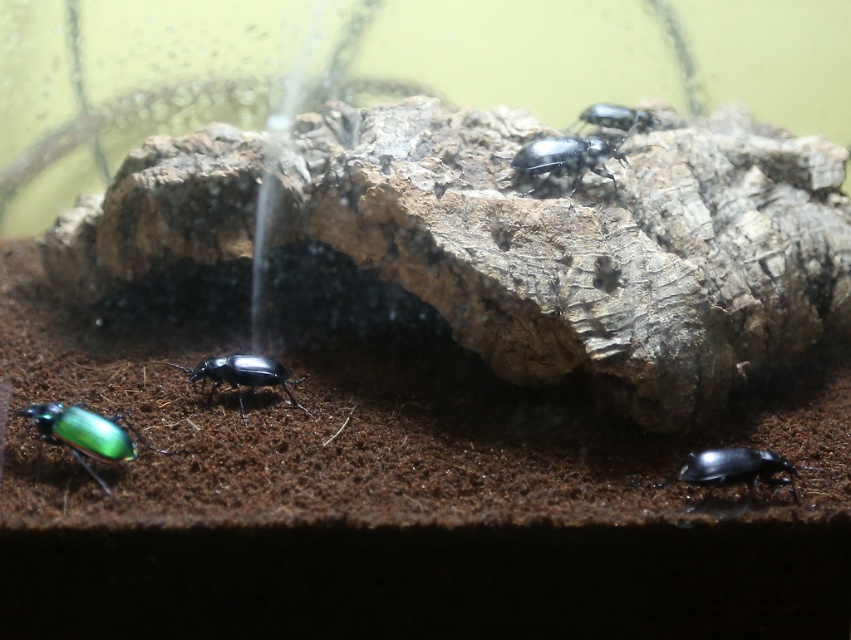
Locate an element on the screen. glossy black beetle at center is located at coordinates (240, 374).

Consider the image. Is glossy black beetle at center smaller than glossy metallic beetle at upper center?

No, glossy black beetle at center is not smaller than glossy metallic beetle at upper center.

Is point (235, 371) behind point (598, 106)?

No, it is not.

I want to click on glossy black beetle at center, so click(240, 374).

Can you confirm if glossy black beetle at lower right is taller than glossy metallic beetle at upper center?

No.

Looking at this image, who is more distant from viewer, [677,474] or [625,125]?

Point [625,125]

Where is `glossy black beetle at lower right`? glossy black beetle at lower right is located at coordinates (735, 468).

Does matte brown rock at center lie behind glossy black beetle at lower right?

Yes, it is behind glossy black beetle at lower right.

Identify the location of matte brown rock at center. (586, 244).

Locate an element on the screen. matte brown rock at center is located at coordinates (586, 244).